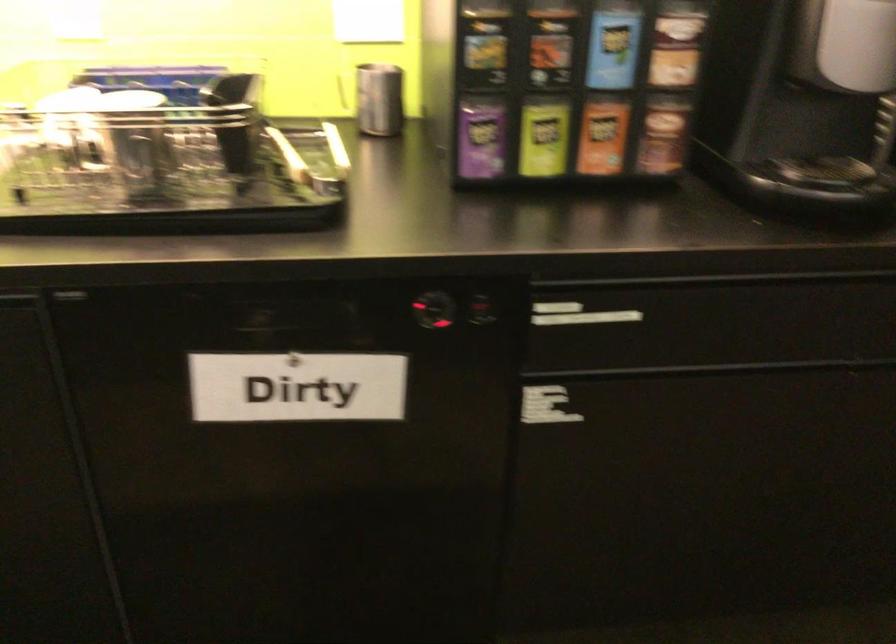
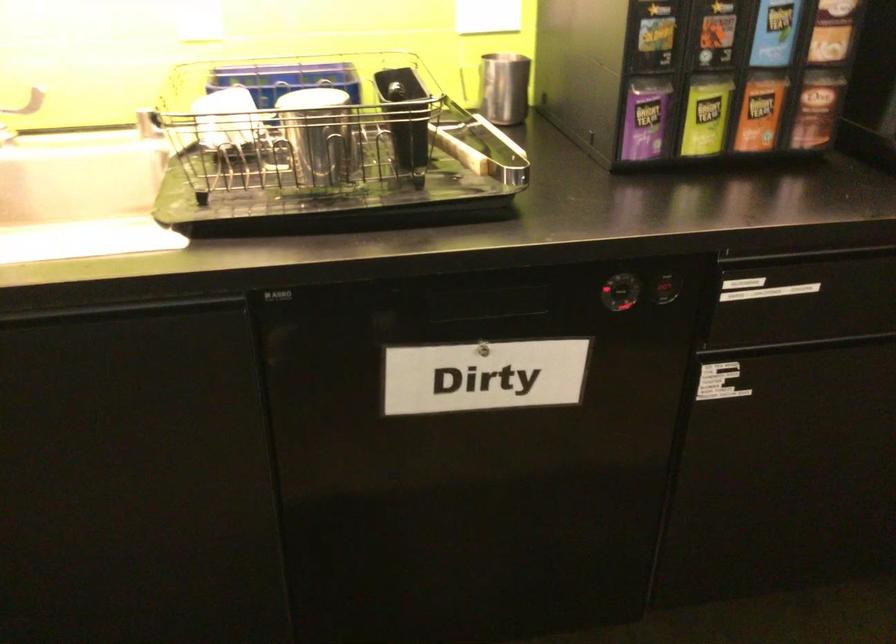
Locate, in the second image, the point that corresponds to point (434, 307) in the first image.

(623, 290)